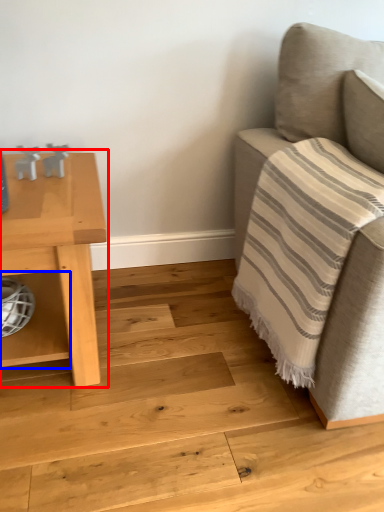
Question: Which point is closer to the camera, table (highlighted by a red box) or shelf (highlighted by a blue box)?

Choices:
 (A) table
 (B) shelf

Answer: (A)